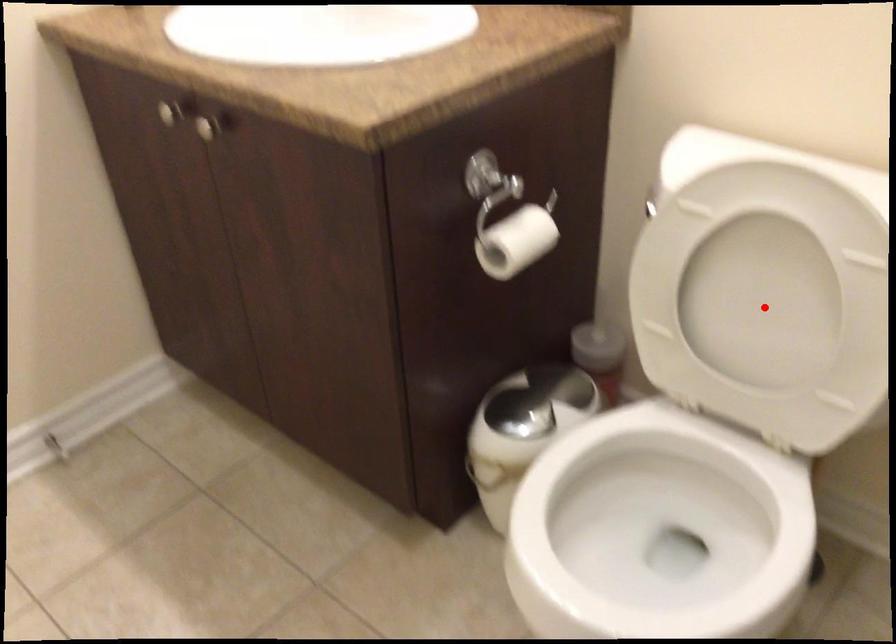
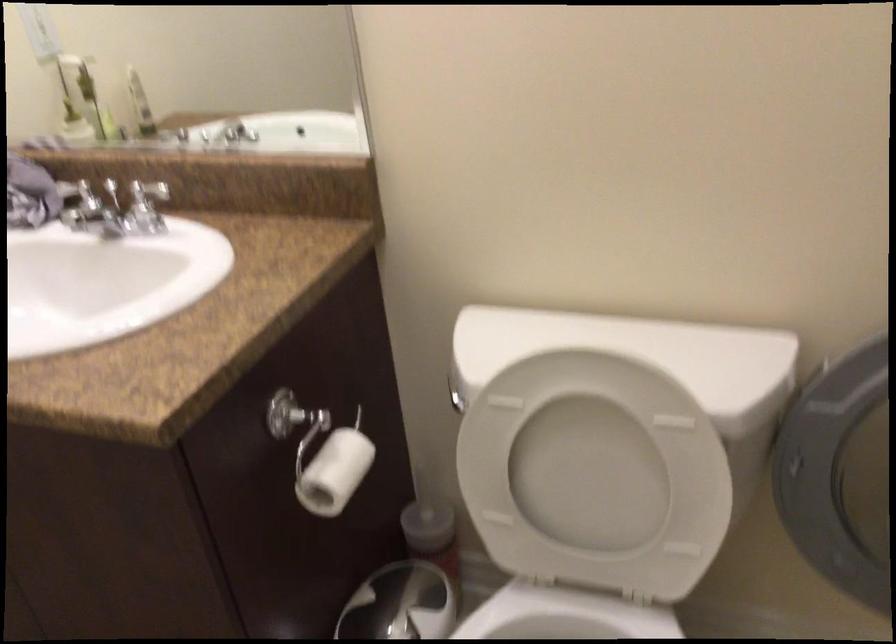
The point at the highlighted location is marked in the first image. Where is the corresponding point in the second image?

(595, 475)